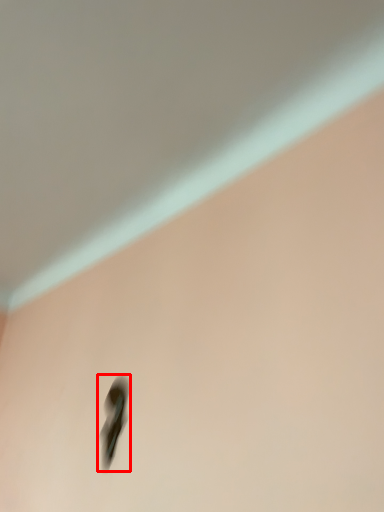
Question: From the image's perspective, where is footwear (annotated by the red box) located in relation to backdrop in the image?

Choices:
 (A) below
 (B) above

Answer: (A)